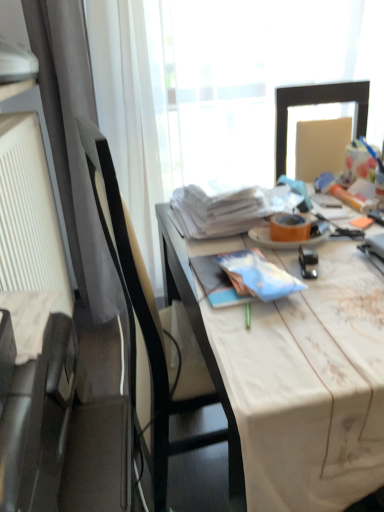
At what (x,y) coordinates should I click in order to perform the action: click on unoccupied region to the right of metallic black stapler at center-right. Please return your answer as a coordinate pair (x, y). The height and width of the screenshot is (512, 384). Looking at the image, I should click on (356, 259).